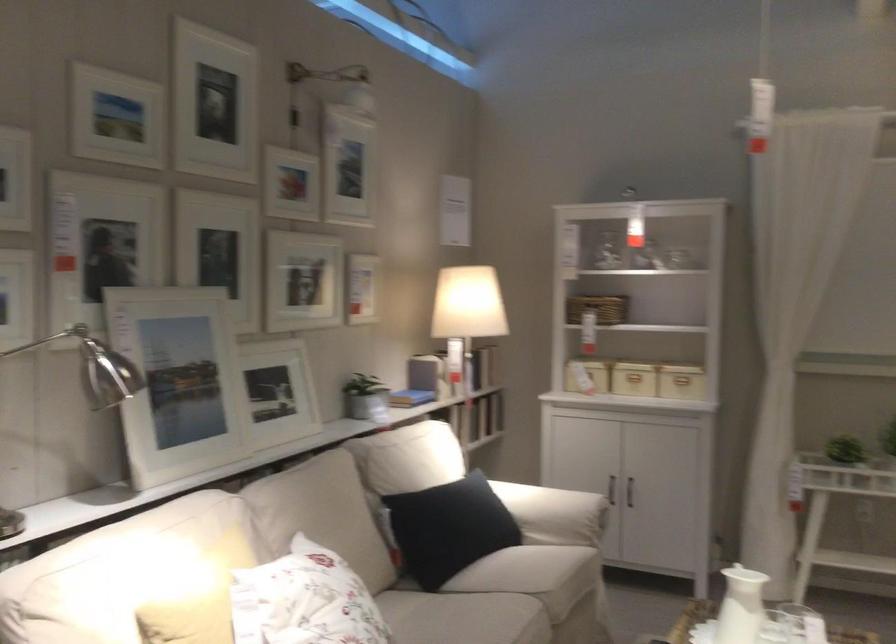
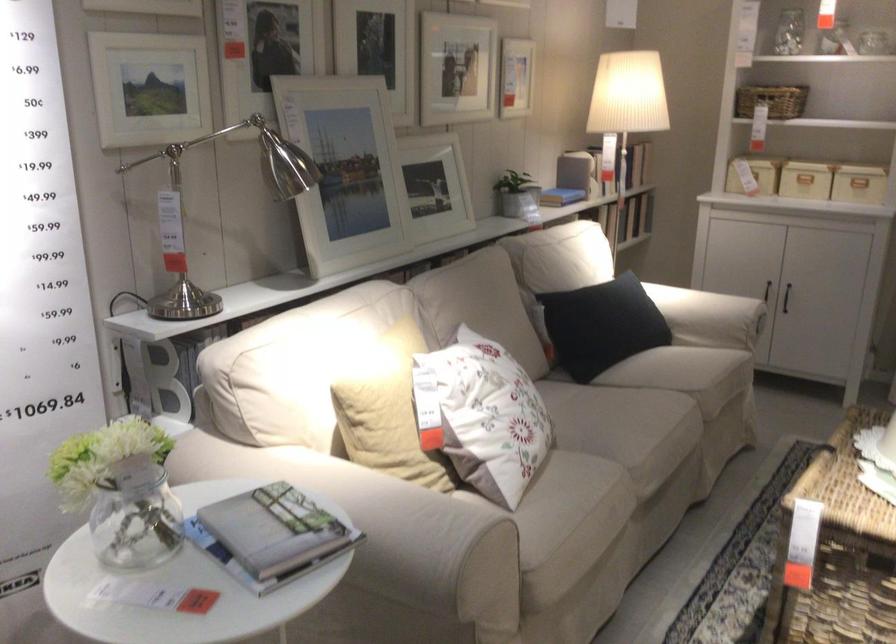
Locate, in the second image, the point that corresponds to (x=590, y=384) in the first image.

(753, 175)